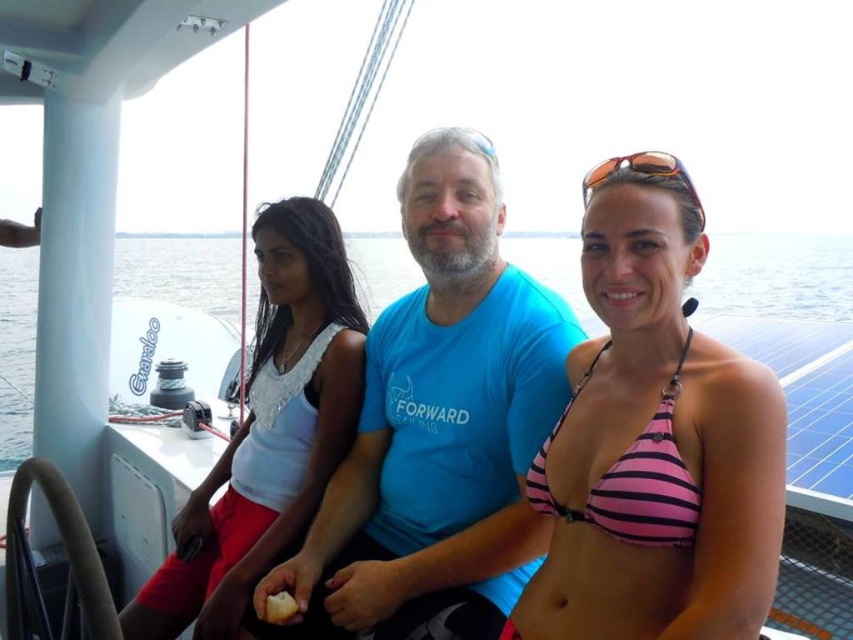
You are standing on the boat and want to take a photo of the clear blue water at center. Where should you point your camera?

You should point your camera towards the center of the boat where the clear blue water at center is located at coordinates point [776,276].

You are navigating a drone to deliver a package to the blue t shirt at center in the image. The drone has a GPS coordinate system where the bottom left corner is the origin point. The coordinate of the blue t shirt at center is at point (x=438, y=420). What are the coordinates of the blue t shirt at center?

The coordinates of the blue t shirt at center are at point (x=438, y=420).